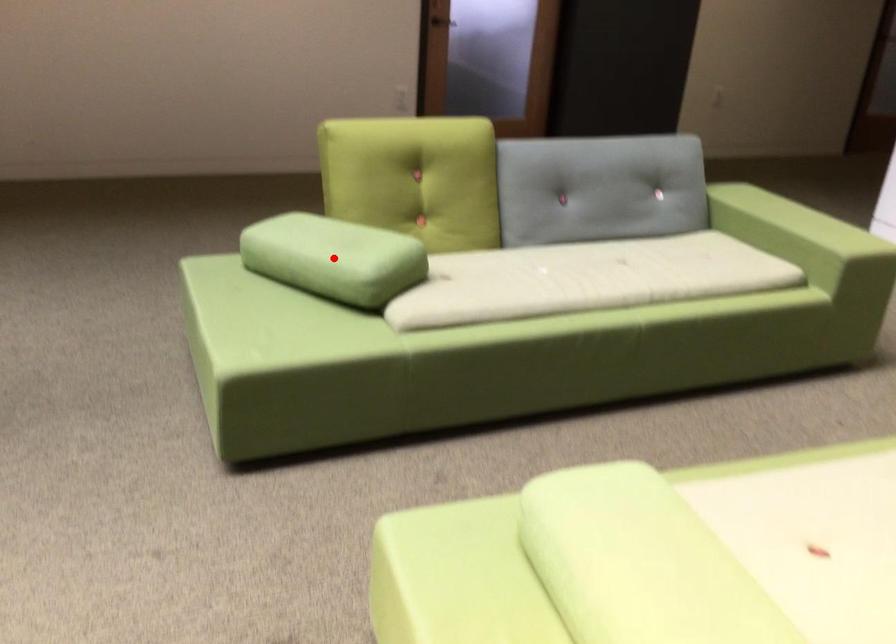
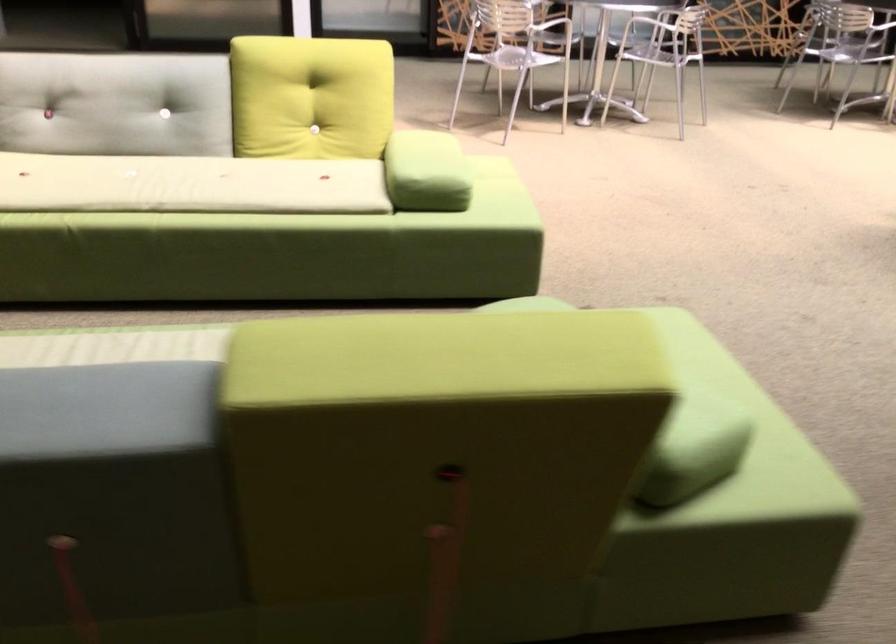
Question: I am providing you with two images of the same scene from different viewpoints. A red point is marked on the first image. At the location where the point appears in image 1, is it still visible in image 2?

Choices:
 (A) Yes
 (B) No

Answer: (B)